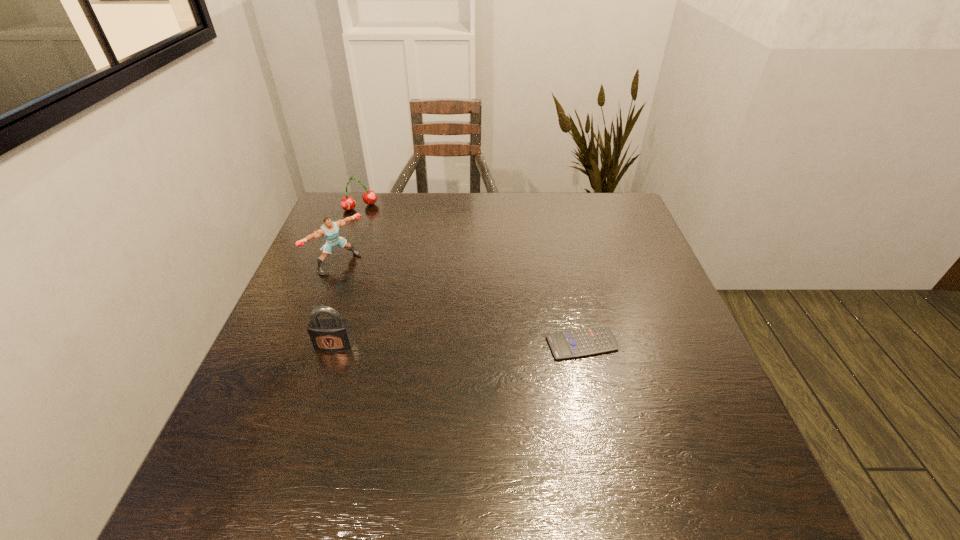
Identify the location of vacant space located 0.180m with stems pointing upwards on the cherry. (384, 244).

Identify the location of vacant space situated on the front-facing side of the puncher. (458, 357).

At what (x,y) coordinates should I click in order to perform the action: click on free spot located 0.160m on the front-facing side of the puncher. Please return your answer as a coordinate pair (x, y). The image size is (960, 540). Looking at the image, I should click on (390, 303).

Where is `vacant space located 0.110m on the front-facing side of the puncher`? vacant space located 0.110m on the front-facing side of the puncher is located at coordinates (377, 294).

Locate an element on the screen. object positioned at the far edge is located at coordinates tap(348, 203).

Where is `padlock that is at the left edge`? padlock that is at the left edge is located at coordinates [x=334, y=333].

The width and height of the screenshot is (960, 540). I want to click on cherry that is at the left edge, so click(348, 203).

Where is `puncher located at the left edge`? puncher located at the left edge is located at coordinates (329, 230).

Where is `object positioned at the far left corner`? object positioned at the far left corner is located at coordinates (348, 203).

Image resolution: width=960 pixels, height=540 pixels. In order to click on vacant position at the far edge of the desktop in this screenshot , I will do [x=583, y=228].